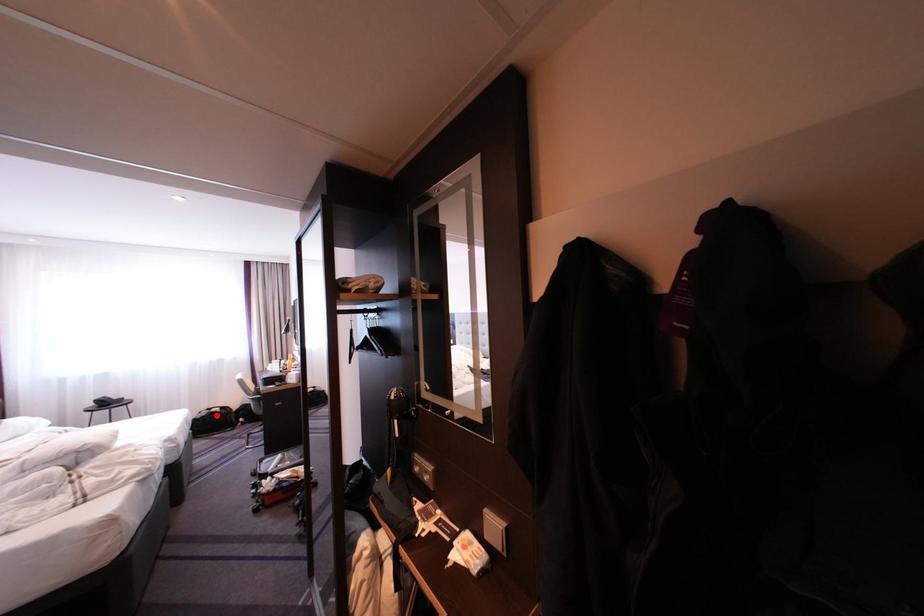
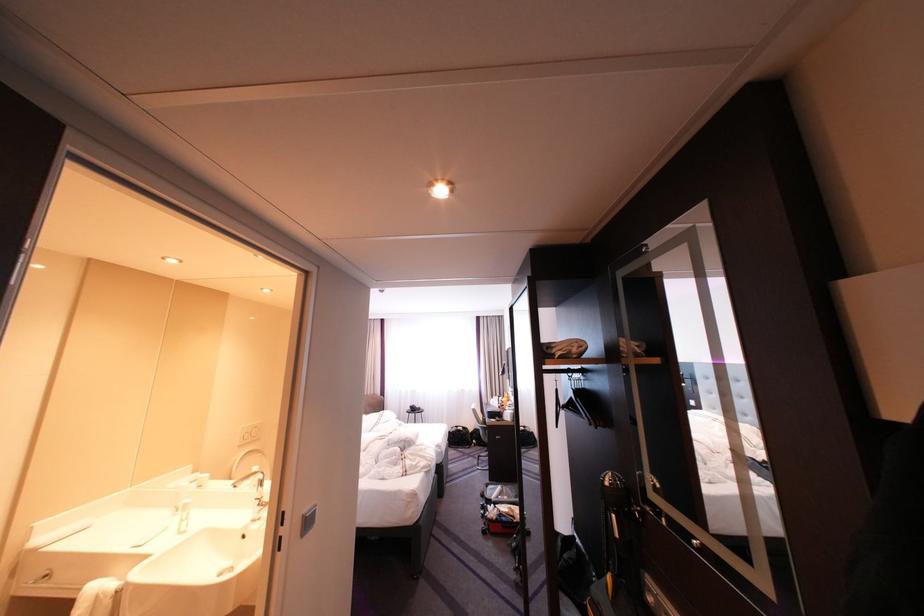
Question: I am providing you with two images of the same scene from different viewpoints. A red point is marked on the first image. Can you still see the location of the red point in image 2?

Choices:
 (A) Yes
 (B) No

Answer: (A)